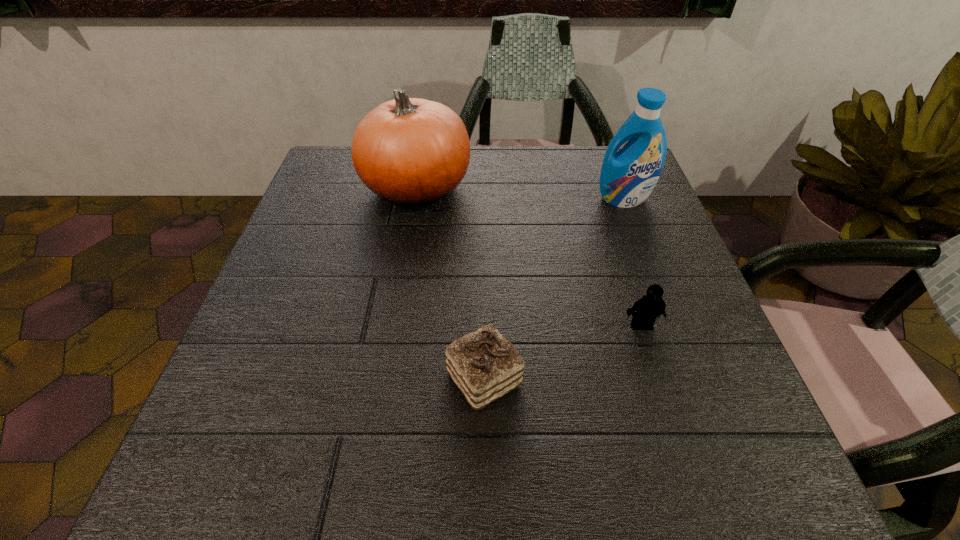
What are the coordinates of `vacant area at the right edge of the desktop` in the screenshot? It's located at (651, 388).

Where is `vacant space at the far left corner of the desktop`? The height and width of the screenshot is (540, 960). vacant space at the far left corner of the desktop is located at coordinates (340, 149).

Identify the location of vacant space in between the detergent and the pumpkin. Image resolution: width=960 pixels, height=540 pixels. (519, 193).

You are a GUI agent. You are given a task and a screenshot of the screen. Output one action in this format:
    pyautogui.click(x=<x>, y=<y>)
    Task: Click on the empty location between the chocolate cake and the third farthest object
    
    Given the screenshot: What is the action you would take?
    pyautogui.click(x=563, y=352)

In order to click on vacant region between the Lego and the detergent in this screenshot , I will do `click(633, 262)`.

Find the location of a particular element. blank region between the detergent and the pumpkin is located at coordinates coord(519,193).

This screenshot has height=540, width=960. Find the location of `vacant point located between the detergent and the third farthest object`. vacant point located between the detergent and the third farthest object is located at coordinates (633, 262).

The width and height of the screenshot is (960, 540). Identify the location of vacant area that lies between the second nearest object and the detergent. (633, 262).

At what (x,y) coordinates should I click in order to perform the action: click on free spot between the detergent and the Lego. Please return your answer as a coordinate pair (x, y). Image resolution: width=960 pixels, height=540 pixels. Looking at the image, I should click on 633,262.

The image size is (960, 540). What are the coordinates of `vacant point located between the pumpkin and the second nearest object` in the screenshot? It's located at (529, 257).